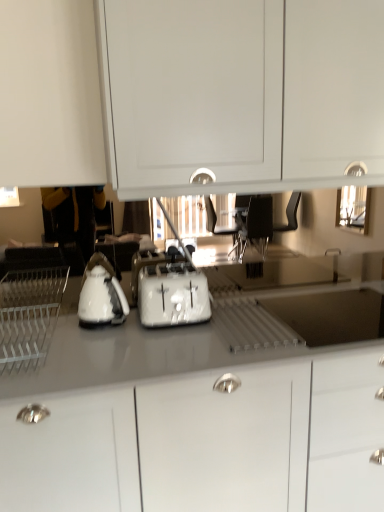
Locate an element on the screen. The width and height of the screenshot is (384, 512). free space in front of white glossy electric kettle at center is located at coordinates (98, 343).